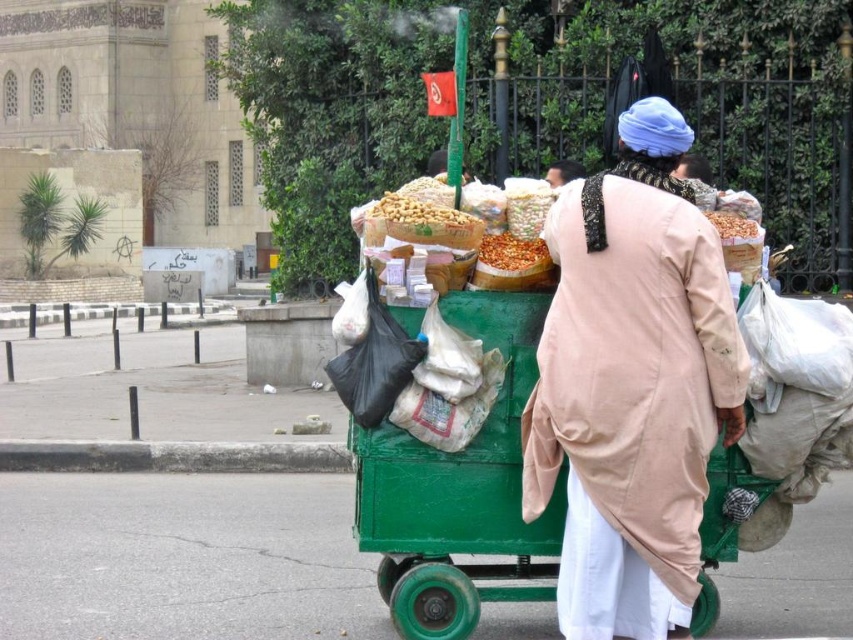
Question: Is smooth brown nuts at center closer to the viewer compared to beige cotton turban at upper center?

Choices:
 (A) yes
 (B) no

Answer: (A)

Question: Which of the following is the farthest from the observer?

Choices:
 (A) beige cotton turban at upper center
 (B) crumbly brown bread at center

Answer: (A)

Question: Does crumbly brown snack at center appear over beige cotton turban at upper center?

Choices:
 (A) no
 (B) yes

Answer: (A)

Question: Which object is the closest to the crumbly brown bread at center?

Choices:
 (A) beige cotton turban at upper center
 (B) crumbly brown snack at center

Answer: (B)

Question: Is beige cotton robe at center thinner than beige cotton turban at upper center?

Choices:
 (A) yes
 (B) no

Answer: (B)

Question: Which object is closer to the camera taking this photo?

Choices:
 (A) beige cotton robe at center
 (B) crumbly brown bread at center

Answer: (A)